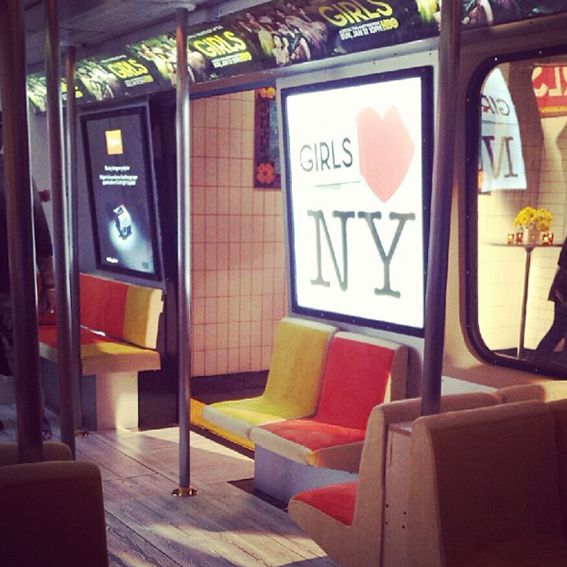
Find the location of a particular element. This screenshot has width=567, height=567. seats is located at coordinates (83, 329), (293, 397), (361, 496).